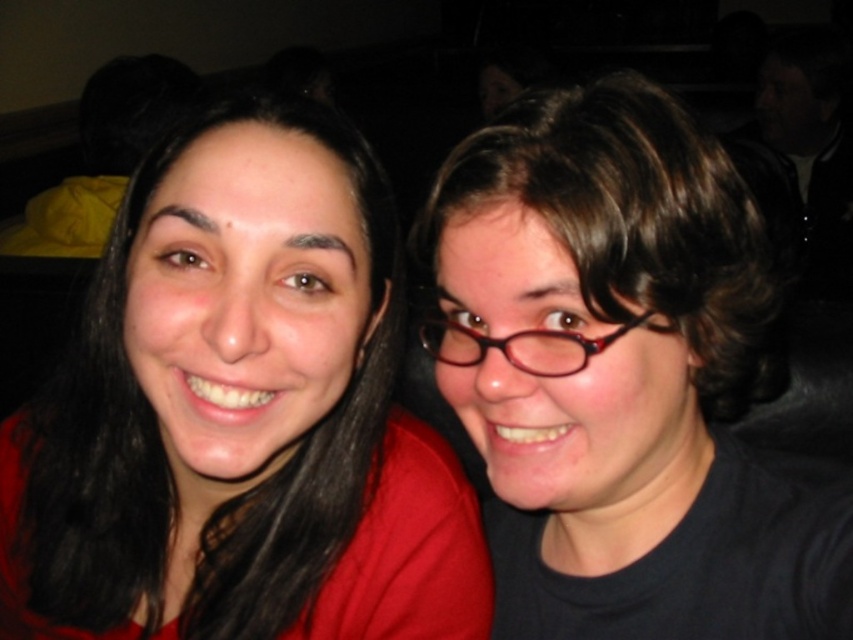
You are taking a photo of two people in a dimly lit room. You notice the matte black hair at left and the black matte glasses at center. Which object is positioned to the right side of the other?

The black matte glasses at center are positioned to the right of the matte black hair at left.

You are taking a photo with two friends. You notice the matte black hair at left and the black matte glasses at center. Which object in the photo appears bigger?

The matte black hair at left appears bigger than the black matte glasses at center.